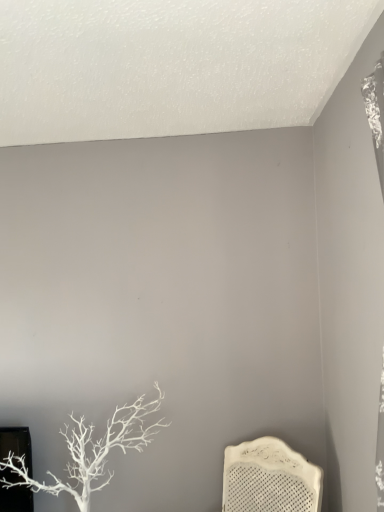
Question: Should I look upward or downward to see white matte tree at lower left?

Choices:
 (A) down
 (B) up

Answer: (A)